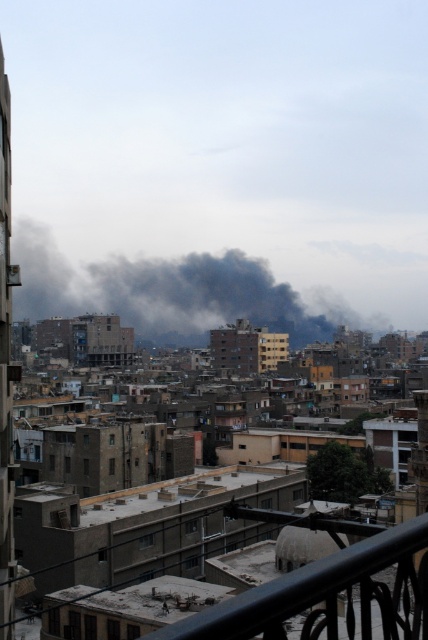
You are a city planner assessing air quality. You observe the black smoke at center and the black metal railing at lower right in the image. Which object appears wider from your vantage point?

The black smoke at center appears wider than the black metal railing at lower right because its width is larger.

You are a city planner evaluating the urban layout. You observe the black smoke at center and the black metal railing at lower right in the scene. Which object appears larger in the image?

The black smoke at center appears larger than the black metal railing at lower right.